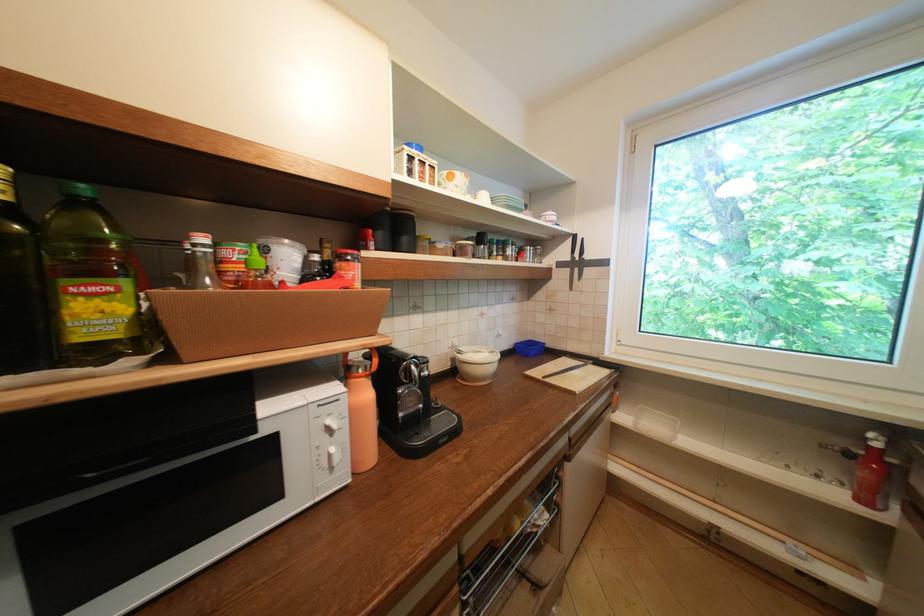
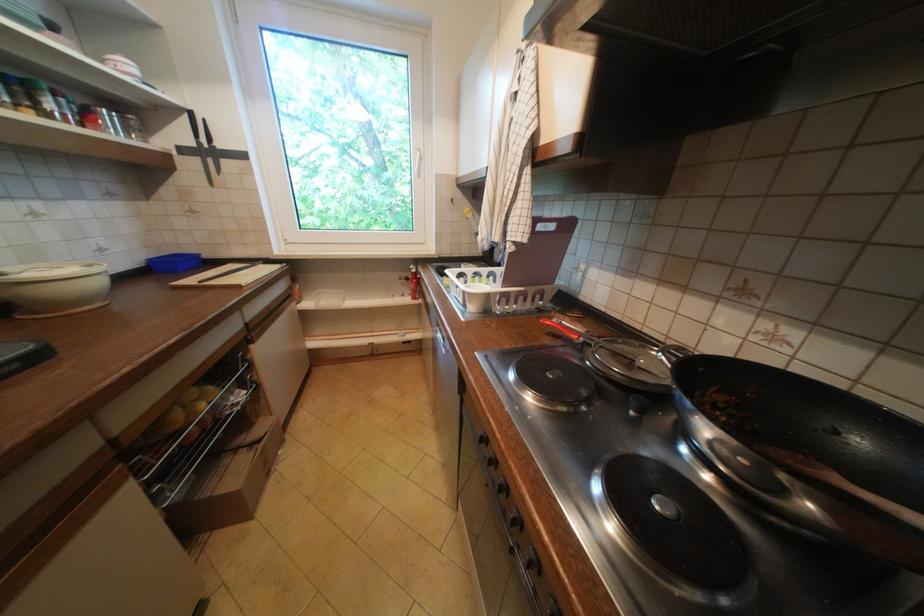
Find the pixel in the second image that matches (x=600, y=363) in the first image.

(270, 262)